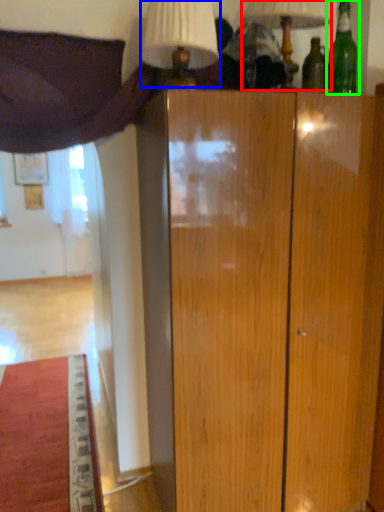
Question: Based on their relative distances, which object is farther from table lamp (highlighted by a red box)? Choose from table lamp (highlighted by a blue box) and bottle (highlighted by a green box).

Choices:
 (A) table lamp
 (B) bottle

Answer: (A)